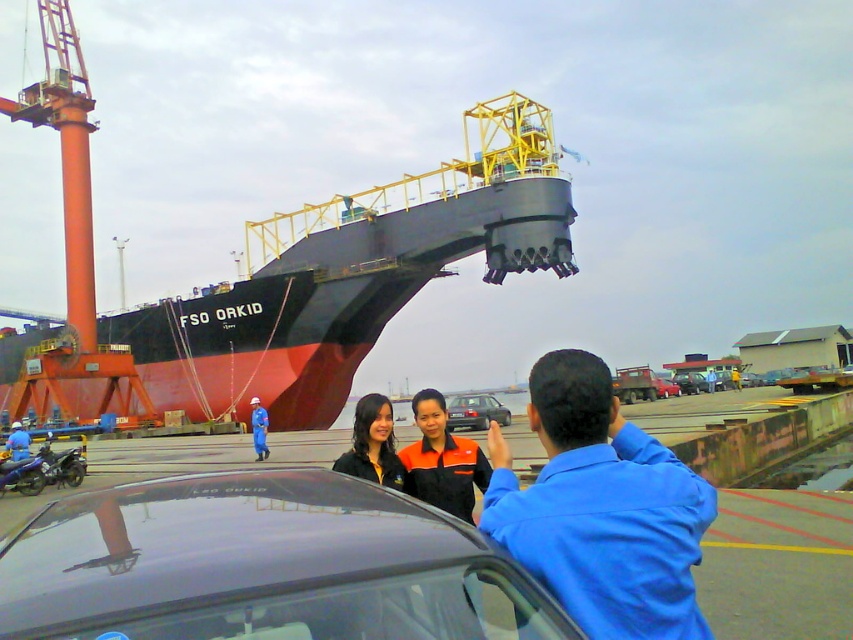
Is metallic red truck at center shorter than blue fabric uniform at center?

In fact, metallic red truck at center may be taller than blue fabric uniform at center.

Is point (634, 369) positioned in front of point (263, 445)?

No, (634, 369) is behind (263, 445).

You are a GUI agent. You are given a task and a screenshot of the screen. Output one action in this format:
    pyautogui.click(x=<x>, y=<y>)
    Task: Click on the metallic red truck at center
    The image size is (853, 640).
    Given the screenshot: What is the action you would take?
    pyautogui.click(x=641, y=385)

Between point (457, 403) and point (265, 412), which one is positioned in front?

Point (265, 412)

Is point (483, 396) less distant than point (253, 396)?

Yes, it is in front of point (253, 396).

Is point (486, 404) positioned in front of point (264, 432)?

No.

Locate an element on the screen. The width and height of the screenshot is (853, 640). satin silver sedan at center is located at coordinates (x=474, y=412).

Can you confirm if black matte ship at center is bigger than matte black jacket at center?

Yes.

Between point (236, 305) and point (368, 404), which one is positioned behind?

Positioned behind is point (236, 305).

Where is `black matte ship at center`? black matte ship at center is located at coordinates (354, 273).